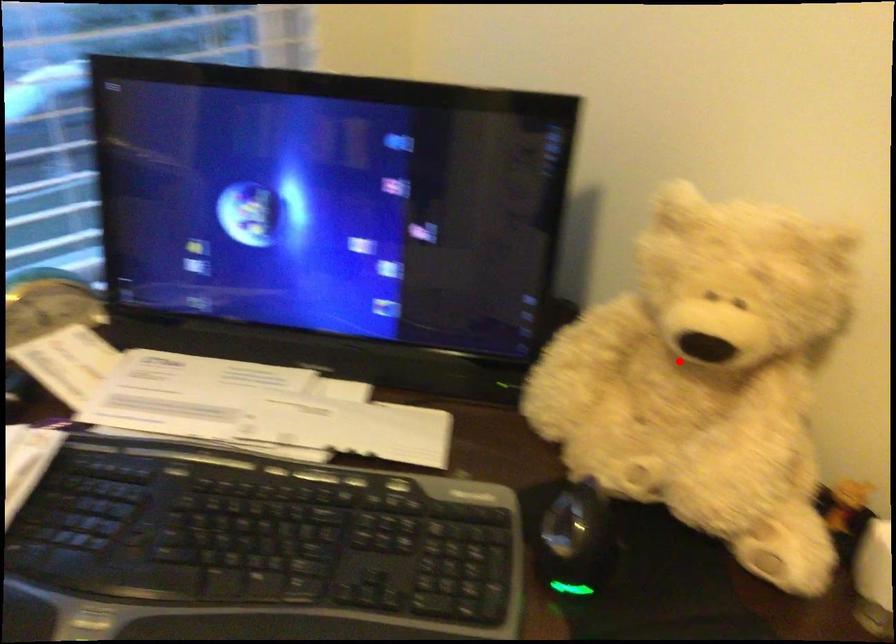
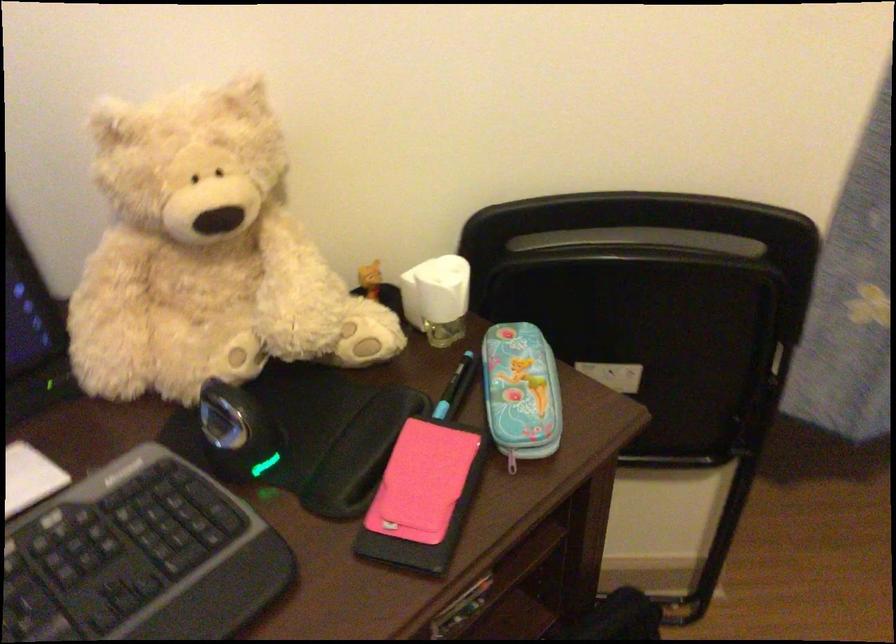
Find the pixel in the second image that matches the highlighted location in the first image.

(205, 254)